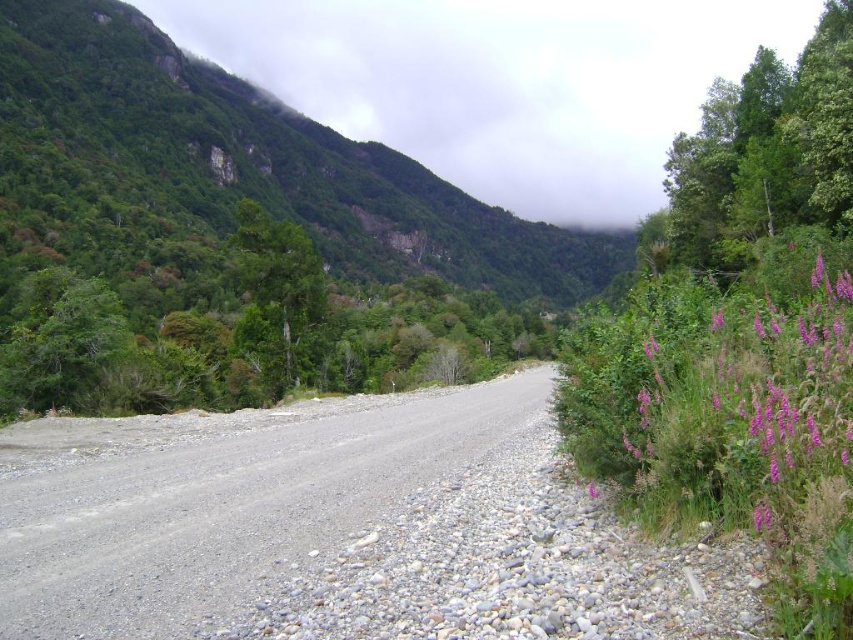
Question: Where is green matte rock at upper center located in relation to gray gravel road at center in the image?

Choices:
 (A) below
 (B) above

Answer: (B)

Question: Is green matte rock at upper center wider than green textured rock at upper center?

Choices:
 (A) no
 (B) yes

Answer: (B)

Question: Is green matte rock at upper center bigger than purple matte flower at right?

Choices:
 (A) no
 (B) yes

Answer: (B)

Question: Which object is positioned farthest from the purple matte flower at right?

Choices:
 (A) purple fuzzy flowers at right
 (B) gray gravel road at center
 (C) green textured rock at upper center
 (D) green matte rock at upper center

Answer: (D)

Question: Based on their relative distances, which object is nearer to the green matte rock at upper center?

Choices:
 (A) gray gravel road at center
 (B) purple fuzzy flowers at right

Answer: (A)

Question: Which of the following is the farthest from the observer?

Choices:
 (A) gray gravel road at center
 (B) green matte rock at upper center
 (C) green textured rock at upper center

Answer: (B)